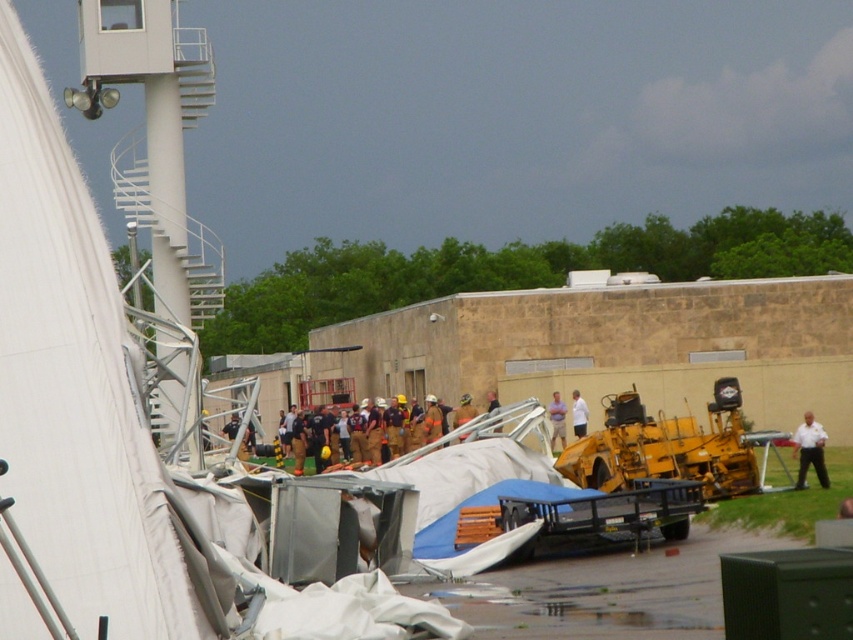
From the picture: You are an emergency coordinator assessing the scene. You notice the light blue shirt at center and the white fabric at center. Which object is smaller in size?

The light blue shirt at center has a smaller size compared to the white fabric at center, so the light blue shirt at center is smaller.

You are an emergency responder at the scene. You need to quickly locate both the white uniform at right and the light brown leather jacket at center. Based on their positions, which one is farther to the left?

The light brown leather jacket at center is farther to the left because the white uniform at right is positioned to the right of it.

You are a photographer trying to capture a clear photo of both the brown uniform at center and the black uniformed person at center. Since you want both subjects to be in focus, which one should you adjust your camera focus on first?

The brown uniform at center is closer to you than the black uniformed person at center. To ensure both are in focus, you should focus on the brown uniform at center first, as it is the closer subject.